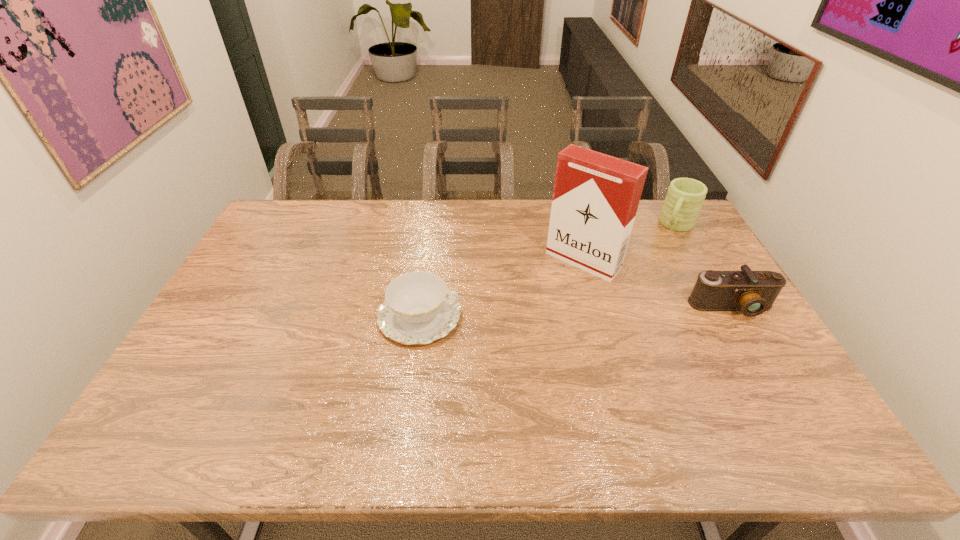
Where is `chinaware`? The width and height of the screenshot is (960, 540). chinaware is located at coordinates (418, 308).

At what (x,y) coordinates should I click in order to perform the action: click on the shortest object. Please return your answer as a coordinate pair (x, y). The width and height of the screenshot is (960, 540). Looking at the image, I should click on (418, 308).

Identify the location of camera. This screenshot has width=960, height=540. (752, 292).

The image size is (960, 540). In order to click on the farthest object in this screenshot , I will do `click(685, 196)`.

Where is `mug`? mug is located at coordinates (685, 196).

The height and width of the screenshot is (540, 960). I want to click on the second object from left to right, so tap(595, 199).

At what (x,y) coordinates should I click in order to perform the action: click on cigarette_case. Please return your answer as a coordinate pair (x, y). Looking at the image, I should click on (595, 199).

This screenshot has height=540, width=960. Identify the location of vacant area situated on the handle side of the leftmost object. (528, 316).

The width and height of the screenshot is (960, 540). What are the coordinates of `vacant space located on the lens of the third tallest object` in the screenshot? It's located at (768, 369).

Locate an element on the screen. blank area located 0.130m on the side of the farthest object with the handle is located at coordinates (660, 255).